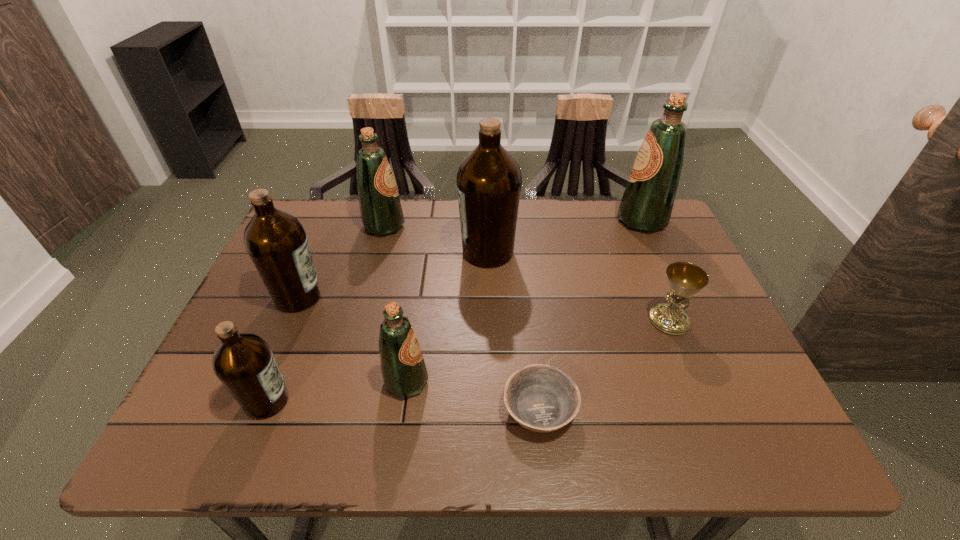
Find the location of a particular element. the biggest brown olive oil is located at coordinates (489, 180).

Find the location of a particular element. the farthest brown olive oil is located at coordinates pos(489,180).

This screenshot has width=960, height=540. Identify the location of the rightmost green olive oil. [x=647, y=202].

Identify the location of the rightmost olive oil. Image resolution: width=960 pixels, height=540 pixels. (647, 202).

The image size is (960, 540). In order to click on the second smallest green olive oil in this screenshot , I will do `click(381, 213)`.

I want to click on the third object from left to right, so pyautogui.click(x=381, y=213).

The width and height of the screenshot is (960, 540). Identify the location of the second biggest brown olive oil. pyautogui.click(x=276, y=241).

This screenshot has width=960, height=540. Find the location of `the second nearest brown olive oil`. the second nearest brown olive oil is located at coordinates (276, 241).

You are a GUI agent. You are given a task and a screenshot of the screen. Output one action in this format:
    pyautogui.click(x=<x>, y=<y>)
    Task: Click on the nearest green olive oil
    
    Given the screenshot: What is the action you would take?
    pyautogui.click(x=404, y=372)

At what (x,y) coordinates should I click in order to perform the action: click on the smallest green olive oil. Please return your answer as a coordinate pair (x, y). The height and width of the screenshot is (540, 960). Looking at the image, I should click on (404, 372).